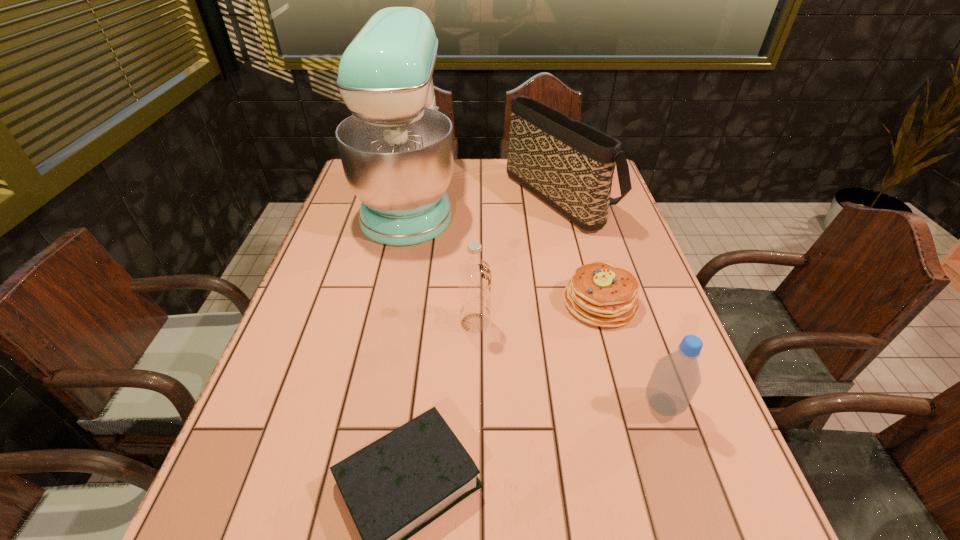
At what (x,y) coordinates should I click in order to perform the action: click on free region at the right edge of the desktop. Please return your answer as a coordinate pair (x, y). The width and height of the screenshot is (960, 540). Looking at the image, I should click on (666, 421).

The width and height of the screenshot is (960, 540). Find the location of `vacant region between the second shortest object and the third shortest object`. vacant region between the second shortest object and the third shortest object is located at coordinates (632, 354).

The width and height of the screenshot is (960, 540). I want to click on free point between the handbag and the vodka, so click(517, 258).

The image size is (960, 540). What are the coordinates of `empty space between the mixer and the vodka` in the screenshot? It's located at (443, 262).

At what (x,y) coordinates should I click in order to perform the action: click on free point between the pancake and the mixer. Please return your answer as a coordinate pair (x, y). This screenshot has height=540, width=960. Looking at the image, I should click on (505, 251).

This screenshot has width=960, height=540. I want to click on unoccupied position between the pancake and the mixer, so pyautogui.click(x=505, y=251).

Locate an element on the screen. free space that is in between the fourth tallest object and the pancake is located at coordinates (632, 354).

Image resolution: width=960 pixels, height=540 pixels. Find the location of `free area in between the fifth tallest object and the third shortest object`. free area in between the fifth tallest object and the third shortest object is located at coordinates (632, 354).

Identify the location of free spot between the vodka and the pancake. The image size is (960, 540). click(538, 313).

At what (x,y) coordinates should I click in order to perform the action: click on object that stands as the second closest to the fifth tallest object. Please return your answer as a coordinate pair (x, y). This screenshot has width=960, height=540. Looking at the image, I should click on (474, 275).